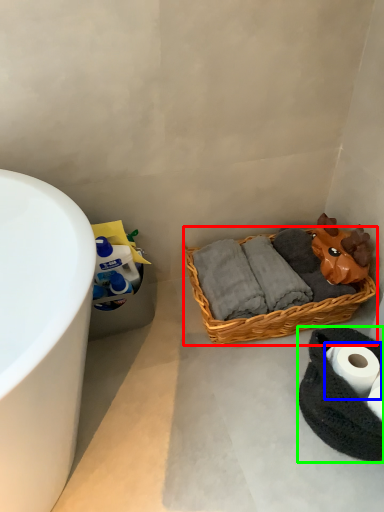
Question: Which object is the farthest from picnic basket (highlighted by a red box)? Choose among these: toilet paper (highlighted by a blue box) or material (highlighted by a green box).

Choices:
 (A) toilet paper
 (B) material

Answer: (A)